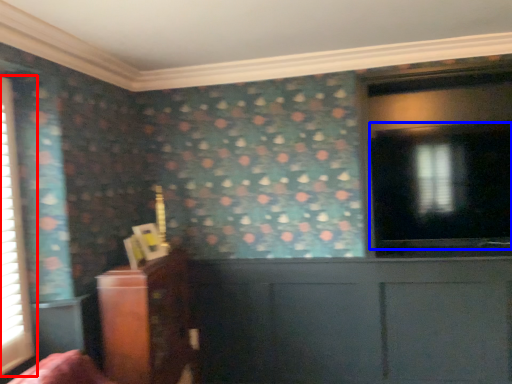
Question: Which object appears closest to the camera in this image, window (highlighted by a red box) or window screen (highlighted by a blue box)?

Choices:
 (A) window
 (B) window screen

Answer: (A)